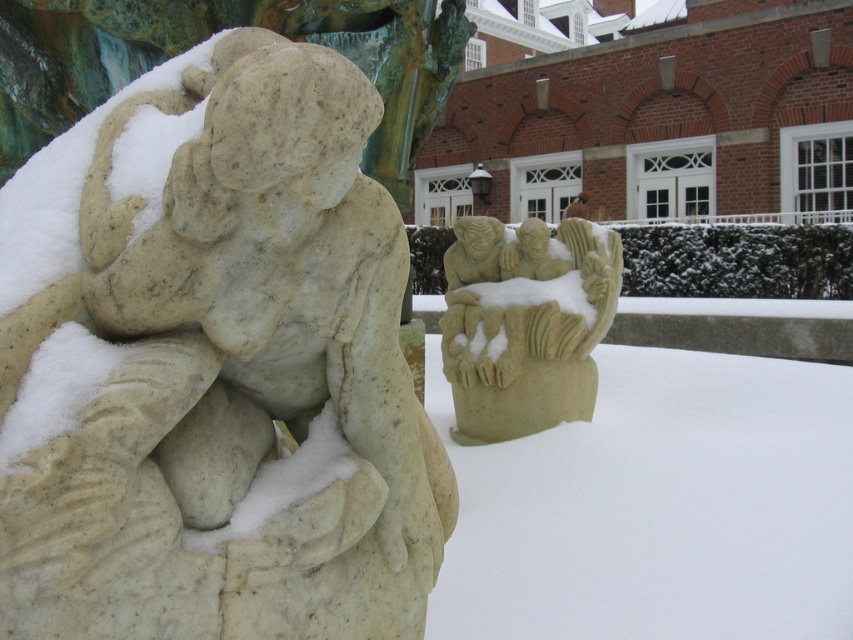
Question: Does white marble statue at left have a lesser width compared to beige stone carving at center?

Choices:
 (A) yes
 (B) no

Answer: (A)

Question: Can you confirm if white marble statue at left is positioned to the left of beige stone carving at center?

Choices:
 (A) no
 (B) yes

Answer: (B)

Question: In this image, where is white marble statue at left located relative to beige stone carving at center?

Choices:
 (A) left
 (B) right

Answer: (A)